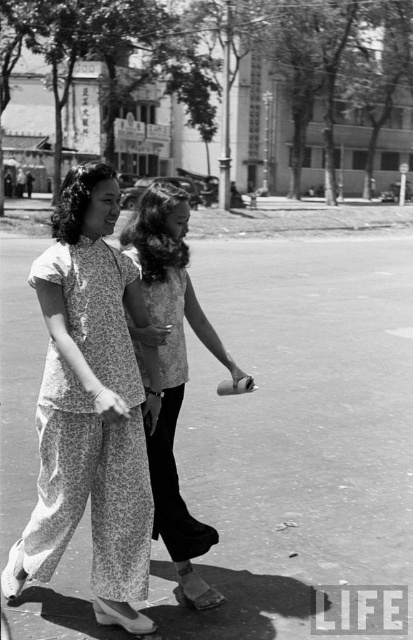
Which is more to the left, printed cotton dress at center or floral fabric dress at center?

printed cotton dress at center is more to the left.

This screenshot has height=640, width=413. Describe the element at coordinates (90, 406) in the screenshot. I see `printed cotton dress at center` at that location.

This screenshot has height=640, width=413. I want to click on printed cotton dress at center, so click(x=90, y=406).